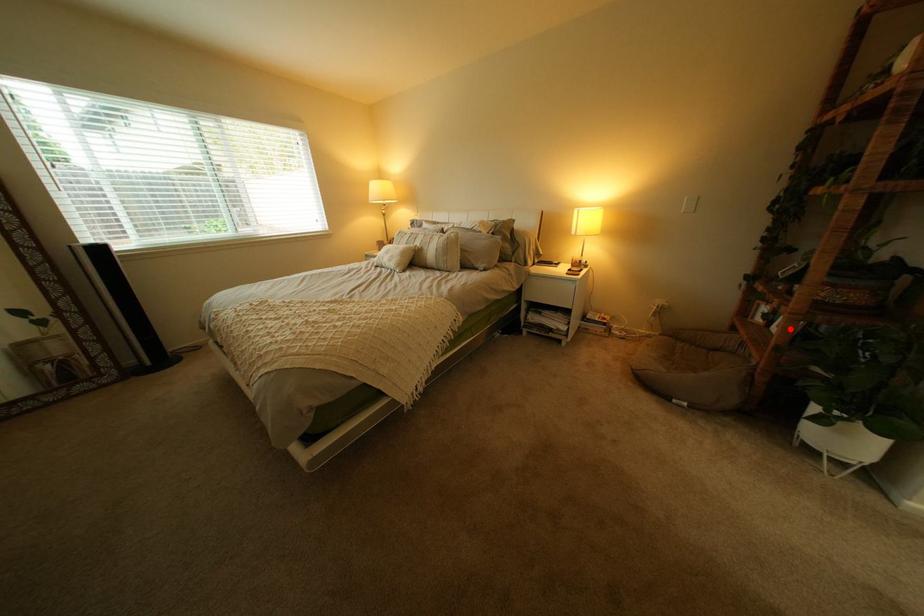
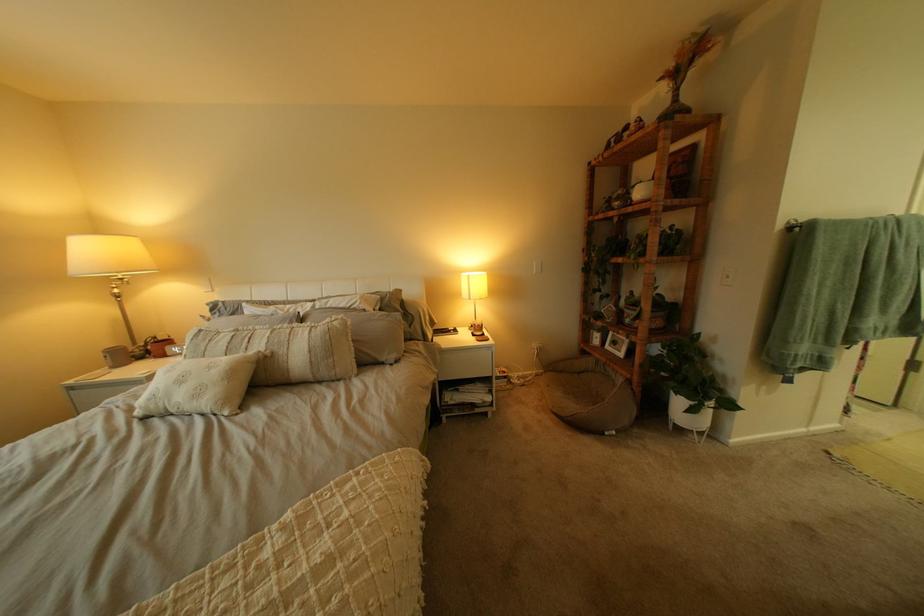
The point at the highlighted location is marked in the first image. Where is the corresponding point in the second image?

(623, 347)